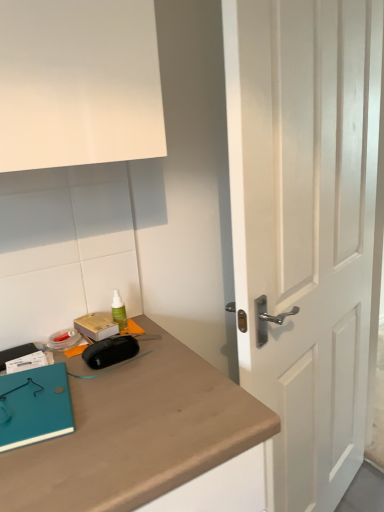
You are a GUI agent. You are given a task and a screenshot of the screen. Output one action in this format:
    pyautogui.click(x=<x>, y=<y>)
    Task: Click on the free space above teal matte notebook at lower left (from a real-world perspective)
    
    Given the screenshot: What is the action you would take?
    pyautogui.click(x=31, y=395)